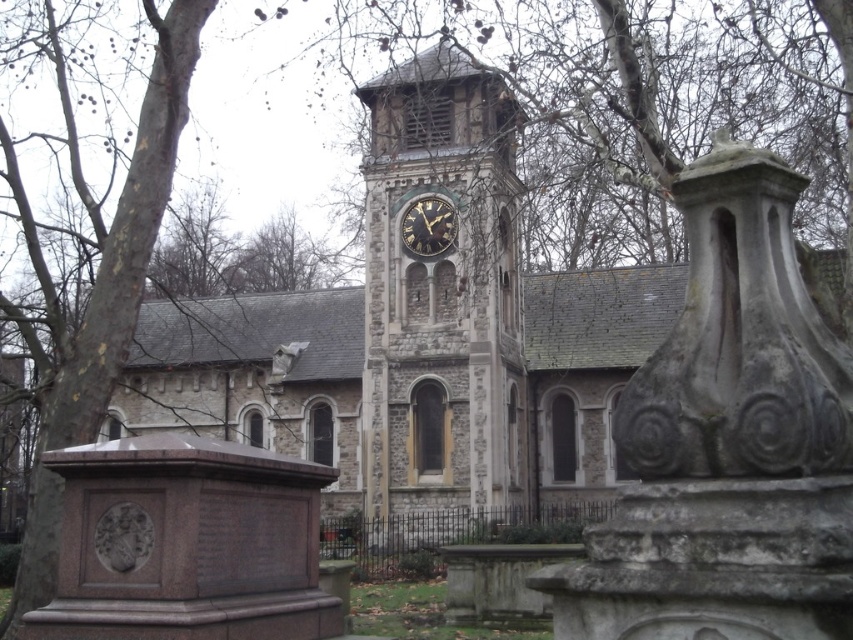
Question: Can you confirm if stone clock tower at center is positioned to the left of dark gray stone clock at center?

Choices:
 (A) yes
 (B) no

Answer: (B)

Question: Among these points, which one is farthest from the camera?

Choices:
 (A) (421, 211)
 (B) (497, 257)

Answer: (A)

Question: Does stone clock tower at center have a greater width compared to dark gray stone clock at center?

Choices:
 (A) yes
 (B) no

Answer: (A)

Question: Observing the image, what is the correct spatial positioning of stone clock tower at center in reference to dark gray stone clock at center?

Choices:
 (A) right
 (B) left

Answer: (A)